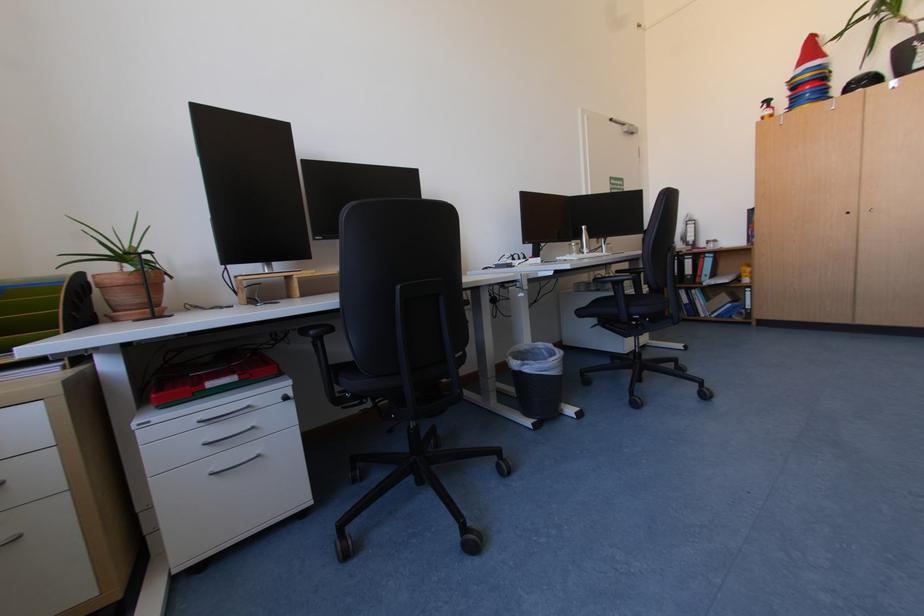
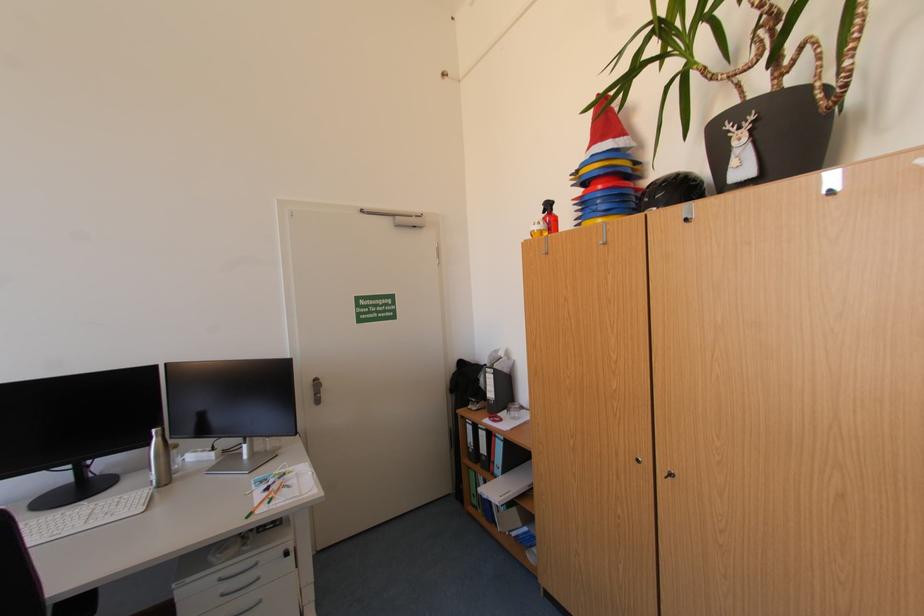
Where in the second image is the point corresponding to [770,108] from the first image?

(552, 213)